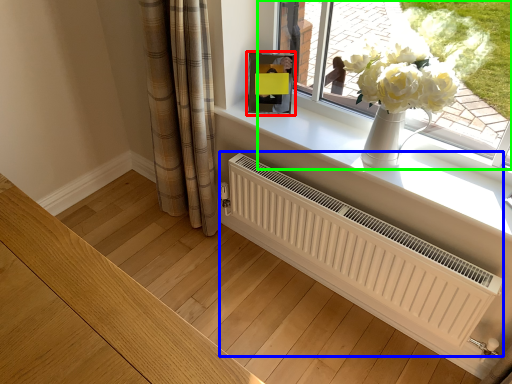
Question: Based on their relative distances, which object is nearer to picture frame (highlighted by a red box)? Choose from radiator (highlighted by a blue box) and window (highlighted by a green box).

Choices:
 (A) radiator
 (B) window

Answer: (B)